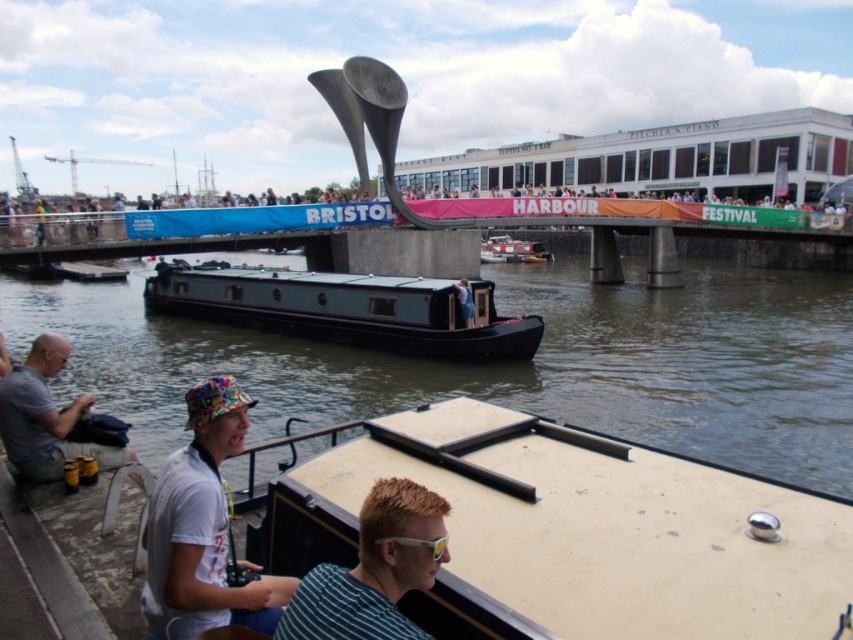
Question: Which point appears closest to the camera in this image?

Choices:
 (A) click(26, 436)
 (B) click(439, 550)
 (C) click(373, 376)
 (D) click(426, 509)

Answer: (B)

Question: In this image, where is teal matte boat at center located relative to yellow reflective plastic goggles at lower center?

Choices:
 (A) below
 (B) above

Answer: (B)

Question: Does metallic gray barge at center have a larger size compared to light blue fabric jacket at center?

Choices:
 (A) yes
 (B) no

Answer: (A)

Question: Which point is farther to the camera?

Choices:
 (A) (436, 545)
 (B) (468, 285)
 (C) (39, 465)
 (D) (202, 596)

Answer: (B)

Question: Which of these objects is positioned closest to the metallic gray barge at center?

Choices:
 (A) white cotton shirt at lower left
 (B) beige matte boat at lower center
 (C) dark gray fabric shirt at lower left
 (D) teal matte boat at center

Answer: (D)

Question: Where is beige matte boat at lower center located in relation to white cotton shirt at lower left in the image?

Choices:
 (A) above
 (B) below

Answer: (A)